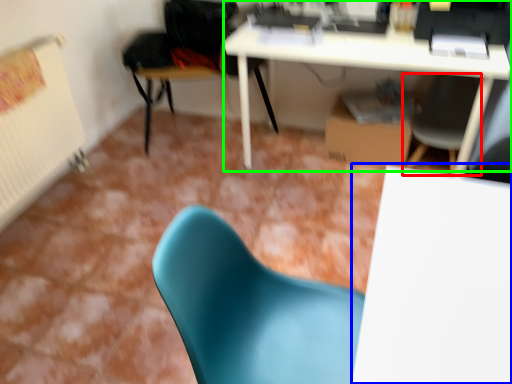
Question: Considering the real-world distances, which object is farthest from chair (highlighted by a red box)? table (highlighted by a blue box) or desk (highlighted by a green box)?

Choices:
 (A) table
 (B) desk

Answer: (A)